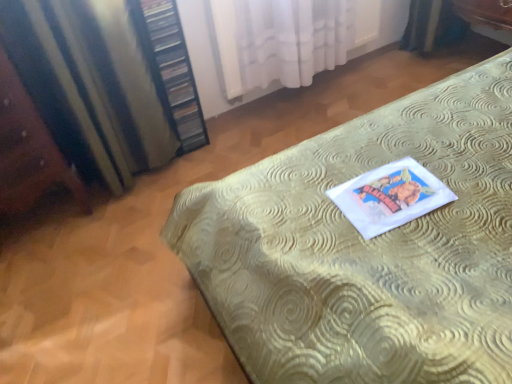
The image size is (512, 384). Identify the location of free area below brown wooden vanity at left (from a real-world perspective). (44, 221).